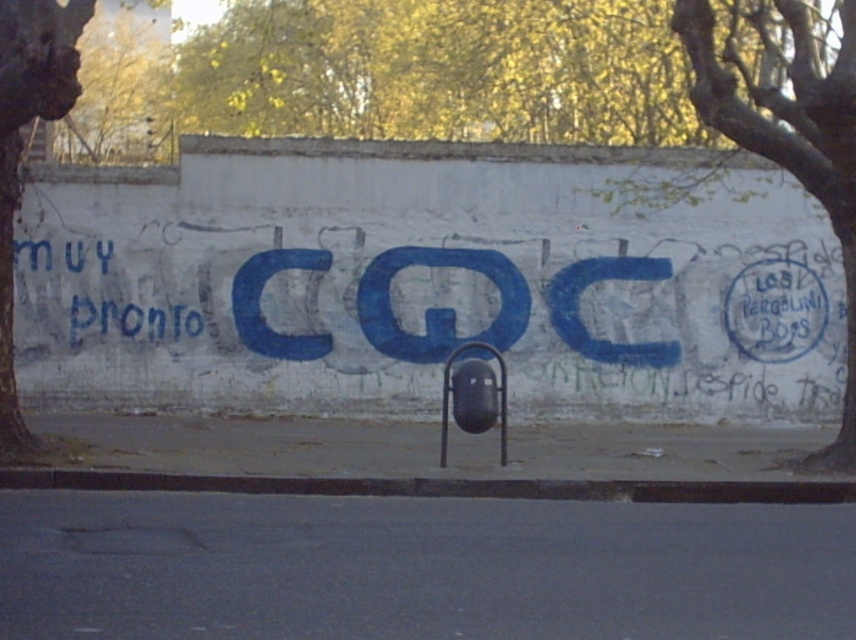
Question: Can you confirm if blue paint at center is smaller than yellow leafy tree at upper center?

Choices:
 (A) no
 (B) yes

Answer: (A)

Question: Is blue paint at center to the left of yellow leafy tree at upper center from the viewer's perspective?

Choices:
 (A) yes
 (B) no

Answer: (B)

Question: Can you confirm if blue paint at center is positioned above yellow leafy tree at upper left?

Choices:
 (A) no
 (B) yes

Answer: (A)

Question: Among these points, which one is farthest from the camera?

Choices:
 (A) pyautogui.click(x=661, y=337)
 (B) pyautogui.click(x=54, y=51)
 (C) pyautogui.click(x=846, y=282)

Answer: (A)

Question: Which point is farther to the camera?

Choices:
 (A) (4, 116)
 (B) (849, 156)
 (C) (131, 19)

Answer: (C)

Question: Considering the real-world distances, which object is farthest from the blue paint at center?

Choices:
 (A) green rough bark tree at left
 (B) yellow leafy tree at upper center
 (C) green leafy tree at upper right

Answer: (A)